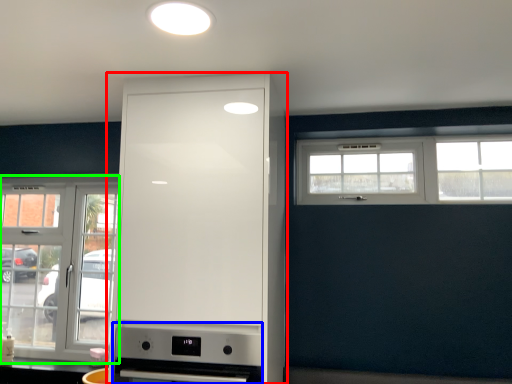
Question: Which is farther away from cabinetry (highlighted by a red box)? appliance (highlighted by a blue box) or window (highlighted by a green box)?

Choices:
 (A) appliance
 (B) window

Answer: (B)